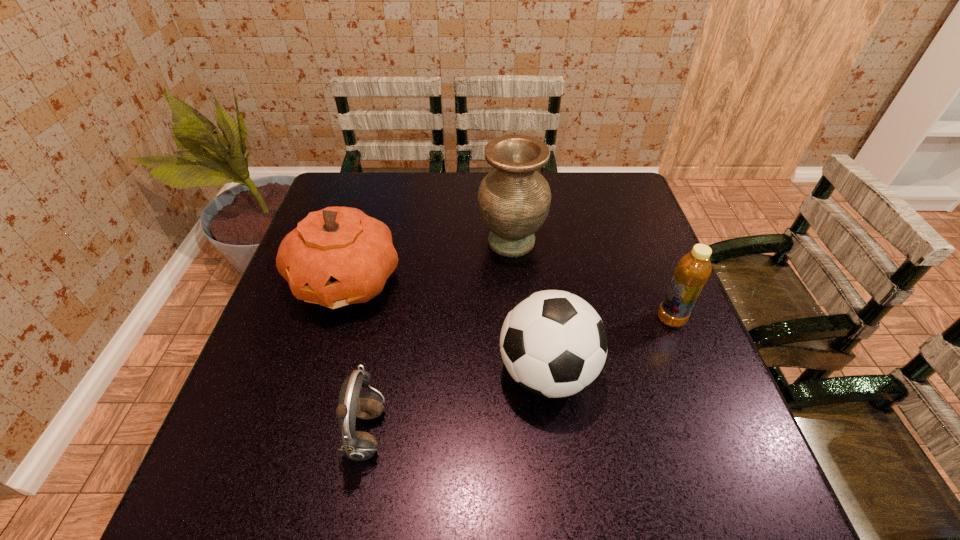
Identify the location of free point between the vase and the shortest object. This screenshot has height=540, width=960. (439, 339).

Identify the location of blank region between the bottle and the tallest object. (591, 281).

Find the location of a particular element. The height and width of the screenshot is (540, 960). vacant space that is in between the pumpkin and the tallest object is located at coordinates (429, 261).

Where is `unoccupied position between the bottle and the pumpkin`? unoccupied position between the bottle and the pumpkin is located at coordinates (509, 300).

Locate an element on the screen. This screenshot has height=540, width=960. empty space between the pumpkin and the soccer ball is located at coordinates (446, 326).

Image resolution: width=960 pixels, height=540 pixels. In order to click on vacant area that lies between the soccer ball and the bottle in this screenshot , I will do [609, 346].

Where is `vacant area between the shortest object and the vase`? The width and height of the screenshot is (960, 540). vacant area between the shortest object and the vase is located at coordinates (439, 339).

Locate which object ranks third in proximity to the shortest object. Please provide its 2D coordinates. Your answer should be formatted as a tuple, i.e. [(x, y)], where the tuple contains the x and y coordinates of a point satisfying the conditions above.

[(514, 200)]

Choose which object is the third nearest neighbor to the pumpkin. Please provide its 2D coordinates. Your answer should be formatted as a tuple, i.e. [(x, y)], where the tuple contains the x and y coordinates of a point satisfying the conditions above.

[(553, 343)]

You are a GUI agent. You are given a task and a screenshot of the screen. Output one action in this format:
    pyautogui.click(x=<x>, y=<y>)
    Task: Click on the free space that satisfies the following two spatial constraints: 1. on the front side of the soccer ball; 2. on the ear pads of the shortest object
    This screenshot has height=540, width=960.
    Given the screenshot: What is the action you would take?
    pyautogui.click(x=555, y=435)